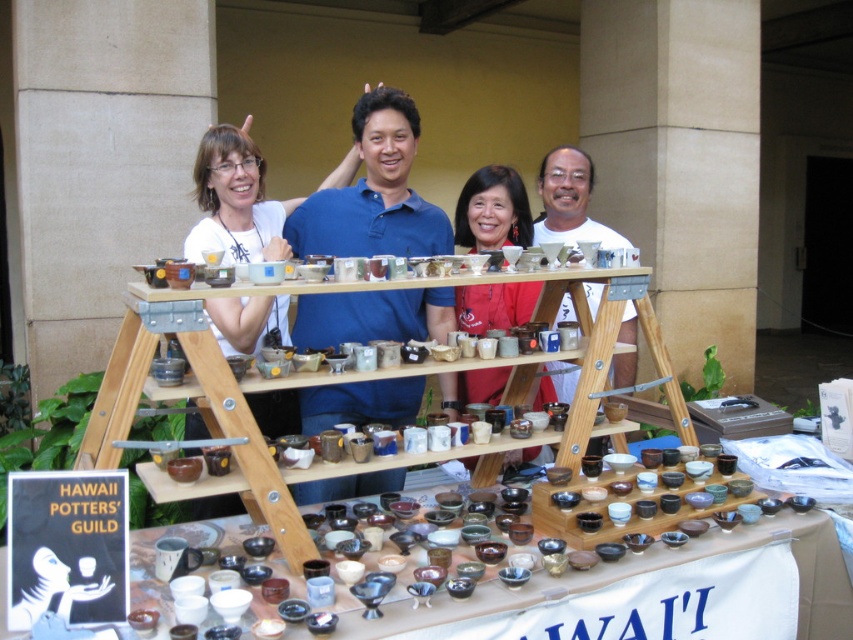
Which is in front, point (221, 365) or point (440, 596)?

Positioned in front is point (440, 596).

The height and width of the screenshot is (640, 853). What do you see at coordinates (234, 433) in the screenshot? I see `wooden shelves at center` at bounding box center [234, 433].

Between point (112, 435) and point (572, 577), which one is positioned behind?

Point (572, 577)

Where is `wooden shelves at center`? wooden shelves at center is located at coordinates (234, 433).

Is wooden shelves at center below matte ceramic bowl at center?

Indeed, wooden shelves at center is positioned under matte ceramic bowl at center.

Is point (583, 348) less distant than point (494, 321)?

Yes, point (583, 348) is in front of point (494, 321).

Does point (279, 492) come farther from viewer compared to point (480, 172)?

No, (279, 492) is in front of (480, 172).

Where is `wooden shelves at center`? wooden shelves at center is located at coordinates (234, 433).

Between matte ceramic bowl at center and matte ceramic bowls at center, which one is positioned higher?

matte ceramic bowl at center

Can you confirm if matte ceramic bowl at center is positioned to the left of matte ceramic bowls at center?

Indeed, matte ceramic bowl at center is positioned on the left side of matte ceramic bowls at center.

Between point (486, 234) and point (0, 612), which one is positioned in front?

Positioned in front is point (0, 612).

The height and width of the screenshot is (640, 853). I want to click on matte ceramic bowl at center, so click(x=492, y=211).